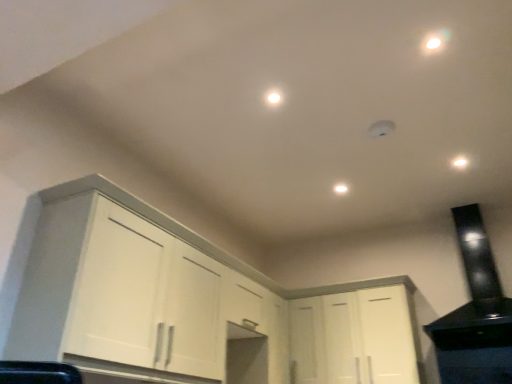
The width and height of the screenshot is (512, 384). What do you see at coordinates (475, 314) in the screenshot?
I see `black glossy range hood at upper right` at bounding box center [475, 314].

At what (x,y) coordinates should I click in order to perform the action: click on white glossy light at center, which is counted as the first dot, starting from the left. Please return your answer as a coordinate pair (x, y). Image resolution: width=512 pixels, height=384 pixels. Looking at the image, I should click on (274, 97).

In order to face white matte cabinet at left, positioned as the first cabinetry in left-to-right order, should I rotate leftwards or rightwards?

You should look left and rotate roughly 8.340 degrees.

Find the location of a particular element. This screenshot has height=384, width=512. black glossy range hood at upper right is located at coordinates (475, 314).

Consider the image. Is white matte light fixture at center, arranged as the 2th dot when viewed from the front, oriented away from white matte cabinet at center, acting as the 1th cabinetry starting from the right?

No, white matte light fixture at center, arranged as the 2th dot when viewed from the front, is not facing away from white matte cabinet at center, acting as the 1th cabinetry starting from the right.

Is white matte light fixture at center, which ranks as the 2th dot in top-to-bottom order, further to camera compared to white matte cabinet at center, which is counted as the second cabinetry, starting from the left?

Yes, it is behind white matte cabinet at center, which is counted as the second cabinetry, starting from the left.

Considering the sizes of objects white matte light fixture at center, the 1th dot in the right-to-left sequence, and white matte cabinet at center, which is counted as the second cabinetry, starting from the left, in the image provided, who is wider, white matte light fixture at center, the 1th dot in the right-to-left sequence, or white matte cabinet at center, which is counted as the second cabinetry, starting from the left,?

Wider between the two is white matte cabinet at center, which is counted as the second cabinetry, starting from the left.

From the image's perspective, relative to white matte cabinet at center, acting as the 1th cabinetry starting from the right, is white matte light fixture at center, acting as the 1th dot starting from the back, above or below?

From the image's perspective, white matte light fixture at center, acting as the 1th dot starting from the back, appears above white matte cabinet at center, acting as the 1th cabinetry starting from the right.

Who is smaller, black glossy range hood at upper right or white matte cabinet at left, acting as the second cabinetry starting from the right?

black glossy range hood at upper right.

Would you say black glossy range hood at upper right is a long distance from white matte cabinet at left, positioned as the first cabinetry in left-to-right order?

That's right, there is a large distance between black glossy range hood at upper right and white matte cabinet at left, positioned as the first cabinetry in left-to-right order.

From the image's perspective, is black glossy range hood at upper right on top of white matte cabinet at left, positioned as the first cabinetry in left-to-right order?

Correct, black glossy range hood at upper right appears higher than white matte cabinet at left, positioned as the first cabinetry in left-to-right order, in the image.

Which object is positioned more to the right, black glossy range hood at upper right or white matte cabinet at left, positioned as the first cabinetry in left-to-right order?

black glossy range hood at upper right.

From a real-world perspective, who is located higher, white glossy light at center, which is counted as the first dot, starting from the left, or black glossy range hood at upper right?

From a 3D spatial view, white glossy light at center, which is counted as the first dot, starting from the left, is above.

Which is in front, point (273, 97) or point (453, 361)?

The point (273, 97) is in front.

Are white glossy light at center, which ranks as the second dot in right-to-left order, and black glossy range hood at upper right beside each other?

No, white glossy light at center, which ranks as the second dot in right-to-left order, is not making contact with black glossy range hood at upper right.

From a real-world perspective, starting from the white matte light fixture at center, acting as the 1th dot starting from the back, which cabinetry is the 2nd one below it? Please provide its 2D coordinates.

[(191, 301)]

Between white matte light fixture at center, arranged as the 2th dot when viewed from the front, and white matte cabinet at left, positioned as the first cabinetry in left-to-right order, which one has larger width?

white matte cabinet at left, positioned as the first cabinetry in left-to-right order, is wider.

Is white matte light fixture at center, acting as the 1th dot starting from the back, next to white matte cabinet at left, acting as the second cabinetry starting from the right, and touching it?

They are not placed beside each other.

Is point (275, 89) less distant than point (308, 353)?

That is True.

Which is correct: white glossy light at center, the 2th dot in the back-to-front sequence, is inside white matte cabinet at center, which is counted as the second cabinetry, starting from the left, or outside of it?

white glossy light at center, the 2th dot in the back-to-front sequence, is located beyond the bounds of white matte cabinet at center, which is counted as the second cabinetry, starting from the left.

Is white glossy light at center, which is the 2th dot from bottom to top, next to white matte cabinet at center, which is counted as the second cabinetry, starting from the left, and touching it?

white glossy light at center, which is the 2th dot from bottom to top, and white matte cabinet at center, which is counted as the second cabinetry, starting from the left, are not in contact.

Considering the positions of objects white matte cabinet at center, which is counted as the second cabinetry, starting from the left, and white glossy light at center, the 2th dot in the back-to-front sequence, in the image provided, who is more to the right, white matte cabinet at center, which is counted as the second cabinetry, starting from the left, or white glossy light at center, the 2th dot in the back-to-front sequence,?

Positioned to the right is white matte cabinet at center, which is counted as the second cabinetry, starting from the left.

Consider the image. Is white matte cabinet at center, acting as the 1th cabinetry starting from the right, far from white glossy light at center, which is counted as the first dot, starting from the left?

white matte cabinet at center, acting as the 1th cabinetry starting from the right, is positioned a significant distance from white glossy light at center, which is counted as the first dot, starting from the left.

Which object is further away from the camera taking this photo, white matte cabinet at center, acting as the 1th cabinetry starting from the right, or white glossy light at center, which is counted as the first dot, starting from the left?

Positioned behind is white matte cabinet at center, acting as the 1th cabinetry starting from the right.

Which object is wider, white matte cabinet at center, which is counted as the second cabinetry, starting from the left, or white glossy light at center, the first dot viewed from the top?

white matte cabinet at center, which is counted as the second cabinetry, starting from the left.

How different are the orientations of white matte cabinet at left, acting as the second cabinetry starting from the right, and white matte light fixture at center, the 1th dot in the right-to-left sequence, in degrees?

2.34 degrees separate the facing orientations of white matte cabinet at left, acting as the second cabinetry starting from the right, and white matte light fixture at center, the 1th dot in the right-to-left sequence.

Between white matte cabinet at left, acting as the second cabinetry starting from the right, and white matte light fixture at center, acting as the 1th dot starting from the back, which one appears on the right side from the viewer's perspective?

Positioned to the right is white matte light fixture at center, acting as the 1th dot starting from the back.

Does white matte cabinet at left, positioned as the first cabinetry in left-to-right order, come behind white matte light fixture at center, the 1th dot in the right-to-left sequence?

No, white matte cabinet at left, positioned as the first cabinetry in left-to-right order, is closer to the viewer.

Considering the relative sizes of white matte cabinet at left, acting as the second cabinetry starting from the right, and white matte light fixture at center, acting as the 1th dot starting from the back, in the image provided, is white matte cabinet at left, acting as the second cabinetry starting from the right, bigger than white matte light fixture at center, acting as the 1th dot starting from the back,?

Correct, white matte cabinet at left, acting as the second cabinetry starting from the right, is larger in size than white matte light fixture at center, acting as the 1th dot starting from the back.

This screenshot has width=512, height=384. In order to click on cabinetry that appears on the right of white matte light fixture at center, arranged as the 2th dot when viewed from the front in this screenshot , I will do 355,337.

From the image's perspective, count 1st cabinetrys downward from the black glossy range hood at upper right and point to it. Please provide its 2D coordinates.

[(191, 301)]

Which object lies nearer to the anchor point black glossy range hood at upper right, white matte cabinet at center, acting as the 1th cabinetry starting from the right, or white matte light fixture at center, the 1th dot in the right-to-left sequence?

white matte cabinet at center, acting as the 1th cabinetry starting from the right, is closer to black glossy range hood at upper right.

Based on their spatial positions, is white matte light fixture at center, the 2th dot when ordered from left to right, or white matte cabinet at center, which is counted as the second cabinetry, starting from the left, further from white matte cabinet at left, positioned as the first cabinetry in left-to-right order?

white matte light fixture at center, the 2th dot when ordered from left to right, lies further to white matte cabinet at left, positioned as the first cabinetry in left-to-right order, than the other object.

Which object lies nearer to the anchor point black glossy range hood at upper right, white matte cabinet at left, acting as the second cabinetry starting from the right, or white glossy light at center, which is counted as the first dot, starting from the left?

white matte cabinet at left, acting as the second cabinetry starting from the right, is positioned closer to the anchor black glossy range hood at upper right.

Based on the photo, estimate the real-world distances between objects in this image. Which object is closer to white glossy light at center, the first dot viewed from the top, white matte cabinet at left, acting as the second cabinetry starting from the right, or white matte cabinet at center, acting as the 1th cabinetry starting from the right?

white matte cabinet at left, acting as the second cabinetry starting from the right.

From the image, which object appears to be nearer to white matte light fixture at center, which appears as the 1th dot when ordered from the bottom, white matte cabinet at left, positioned as the first cabinetry in left-to-right order, or white matte cabinet at center, which is counted as the second cabinetry, starting from the left?

→ white matte cabinet at center, which is counted as the second cabinetry, starting from the left, is closer to white matte light fixture at center, which appears as the 1th dot when ordered from the bottom.

Considering their positions, is white matte cabinet at left, positioned as the first cabinetry in left-to-right order, positioned further to white matte cabinet at center, which is counted as the second cabinetry, starting from the left, than black glossy range hood at upper right?

white matte cabinet at left, positioned as the first cabinetry in left-to-right order, is further to white matte cabinet at center, which is counted as the second cabinetry, starting from the left.

When comparing their distances from white matte light fixture at center, which appears as the 1th dot when ordered from the bottom, does black glossy range hood at upper right or white matte cabinet at left, positioned as the first cabinetry in left-to-right order, seem closer?

black glossy range hood at upper right is closer to white matte light fixture at center, which appears as the 1th dot when ordered from the bottom.

Based on their spatial positions, is white matte cabinet at center, which is counted as the second cabinetry, starting from the left, or white glossy light at center, which appears as the 1th dot when viewed from the front, further from black glossy range hood at upper right?

white glossy light at center, which appears as the 1th dot when viewed from the front, is positioned further to the anchor black glossy range hood at upper right.

Where is `appliance between white glossy light at center, which is counted as the first dot, starting from the left, and white matte cabinet at center, which is counted as the second cabinetry, starting from the left, in the up-down direction`? This screenshot has width=512, height=384. appliance between white glossy light at center, which is counted as the first dot, starting from the left, and white matte cabinet at center, which is counted as the second cabinetry, starting from the left, in the up-down direction is located at coordinates (475, 314).

Locate an element on the screen. The image size is (512, 384). appliance that lies between white matte light fixture at center, acting as the 1th dot starting from the back, and white matte cabinet at center, which is counted as the second cabinetry, starting from the left, from top to bottom is located at coordinates (475, 314).

At what (x,y) coordinates should I click in order to perform the action: click on cabinetry between white glossy light at center, which is counted as the first dot, starting from the left, and white matte cabinet at center, which is counted as the second cabinetry, starting from the left, in the up-down direction. Please return your answer as a coordinate pair (x, y). The height and width of the screenshot is (384, 512). Looking at the image, I should click on (191, 301).

Identify the location of cabinetry between white matte cabinet at left, positioned as the first cabinetry in left-to-right order, and white matte light fixture at center, the 1th dot in the right-to-left sequence, along the z-axis. This screenshot has width=512, height=384. (355, 337).